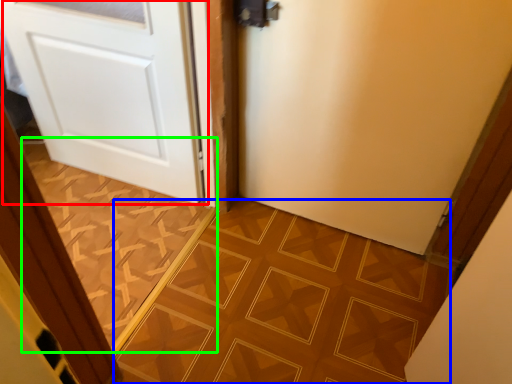
Question: Considering the real-world distances, which object is closest to door (highlighted by a red box)? ceramic tile (highlighted by a blue box) or ceramic tile (highlighted by a green box).

Choices:
 (A) ceramic tile
 (B) ceramic tile

Answer: (B)